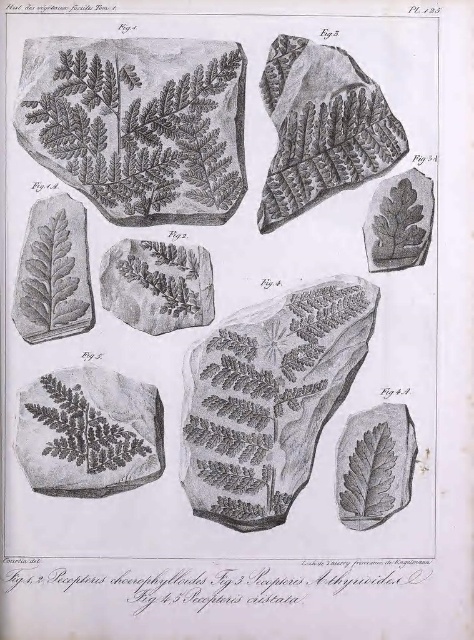
Question: Which object is the closest to the gray textured leaf at center?

Choices:
 (A) smooth gray leaf at lower right
 (B) gray textured leaf at left
 (C) etched stone leaf at center

Answer: (B)

Question: Can you confirm if etched stone leaf at center is positioned below gray textured leaf at upper right?

Choices:
 (A) no
 (B) yes

Answer: (B)

Question: Does gray textured leaf at center appear over smooth gray leaf at lower right?

Choices:
 (A) yes
 (B) no

Answer: (A)

Question: Based on their relative distances, which object is nearer to the etched stone leaf at bottom left?

Choices:
 (A) etched stone leaf at upper center
 (B) gray textured leaf at left
 (C) smooth gray leaf at lower right

Answer: (B)

Question: Is etched stone leaf at bottom left to the left of gray textured leaf at left from the viewer's perspective?

Choices:
 (A) yes
 (B) no

Answer: (B)

Question: Which object is positioned farthest from the etched stone leaf at center?

Choices:
 (A) etched stone leaf at upper center
 (B) smooth gray leaf at lower right
 (C) etched stone leaf at bottom left
 (D) gray textured leaf at left

Answer: (D)